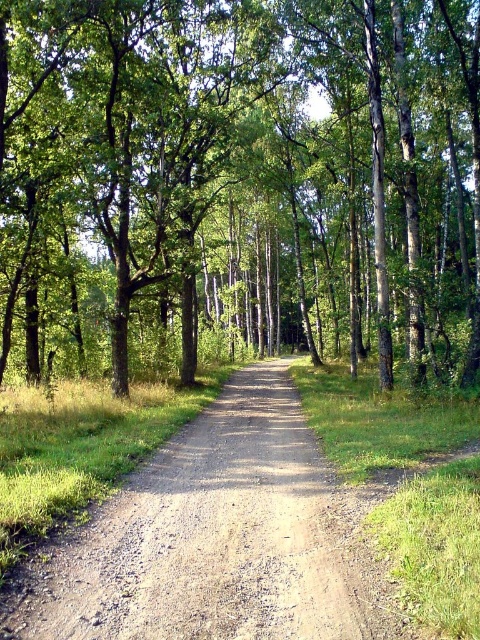
You are a hiker standing on the brown gravel road at center and want to take a photo of the green leafy tree at center. Since you have a wide angle lens, will the tree fill the frame more if you stand closer to it or farther away?

The green leafy tree at center is bigger than brown gravel road at center. If you stand closer to the tree, it will fill the frame more because objects appear larger when you are nearer to them.

You are standing on the forest path and see two points marked on the ground. The first point is at coordinates point (314, 61) and the second is at point (277, 451). Which point is closer to you as you stand at the starting point of the path?

Point (277, 451) is closer to you because it is in front of point (314, 61), which is further back along the path.

You are a hiker carrying a 1.5 meter long backpack. You want to place your backpack between the green leafy tree at center and the brown gravel road at center. Is there enough space between them to fit your backpack?

The distance between the green leafy tree at center and the brown gravel road at center is 21.35 meters, which is significantly larger than the 1.5 meter length of your backpack. Therefore, there is ample space to place your backpack between them.